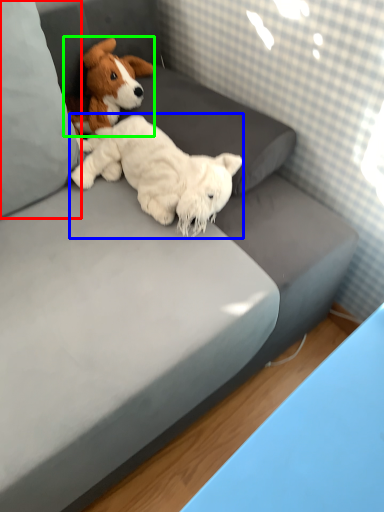
Question: Estimate the real-world distances between objects in this image. Which object is farther from pillow (highlighted by a red box), dog (highlighted by a blue box) or dog (highlighted by a green box)?

Choices:
 (A) dog
 (B) dog

Answer: (B)